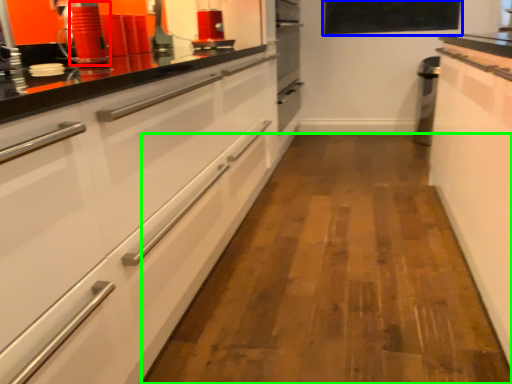
Question: Which object is positioned closest to appliance (highlighted by a red box)? Select from window screen (highlighted by a blue box) and plain (highlighted by a green box).

Choices:
 (A) window screen
 (B) plain

Answer: (B)